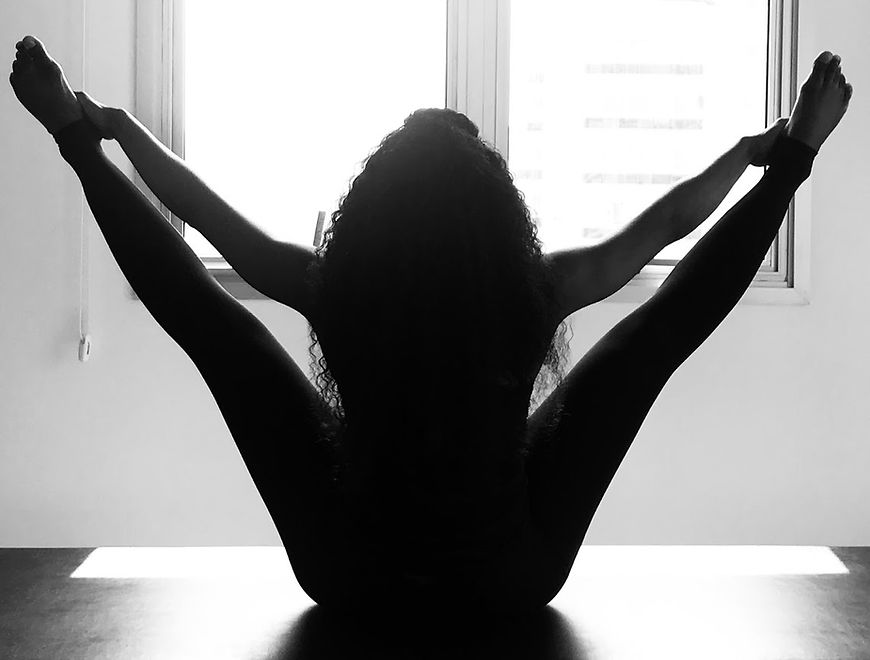
The height and width of the screenshot is (660, 870). What are the coordinates of `window` in the screenshot? It's located at (651, 72).